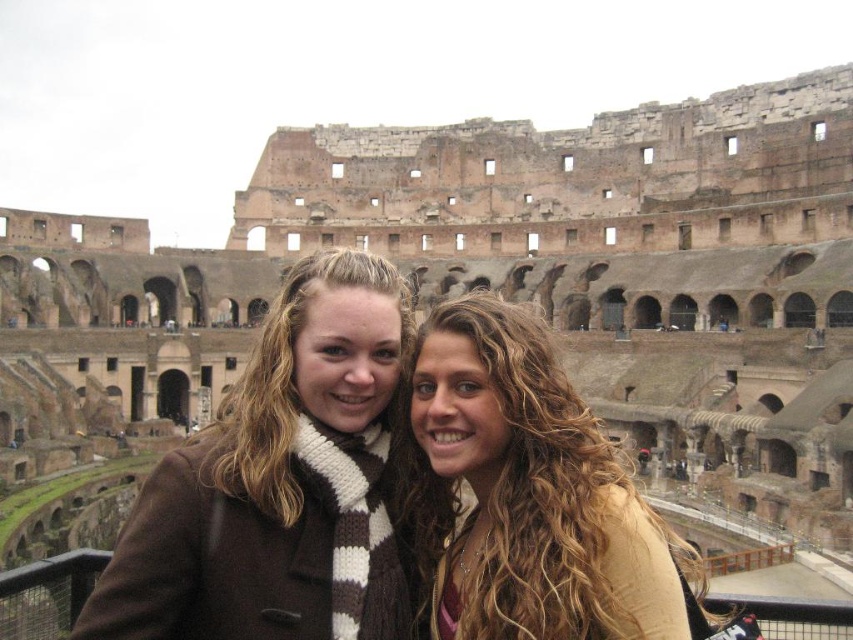
Question: From the image, what is the correct spatial relationship of brown woolen scarf at center in relation to curly hair at center?

Choices:
 (A) left
 (B) right

Answer: (A)

Question: Which point is farther to the camera?

Choices:
 (A) curly hair at center
 (B) brown knitted scarf at center
 (C) brown woolen scarf at center

Answer: (B)

Question: Is the position of brown woolen scarf at center more distant than that of curly hair at center?

Choices:
 (A) yes
 (B) no

Answer: (B)

Question: Does brown woolen scarf at center appear on the left side of brown knitted scarf at center?

Choices:
 (A) yes
 (B) no

Answer: (B)

Question: Which object is positioned closest to the brown woolen scarf at center?

Choices:
 (A) brown knitted scarf at center
 (B) curly hair at center

Answer: (A)

Question: Which object is the farthest from the curly hair at center?

Choices:
 (A) brown knitted scarf at center
 (B) brown woolen scarf at center

Answer: (A)